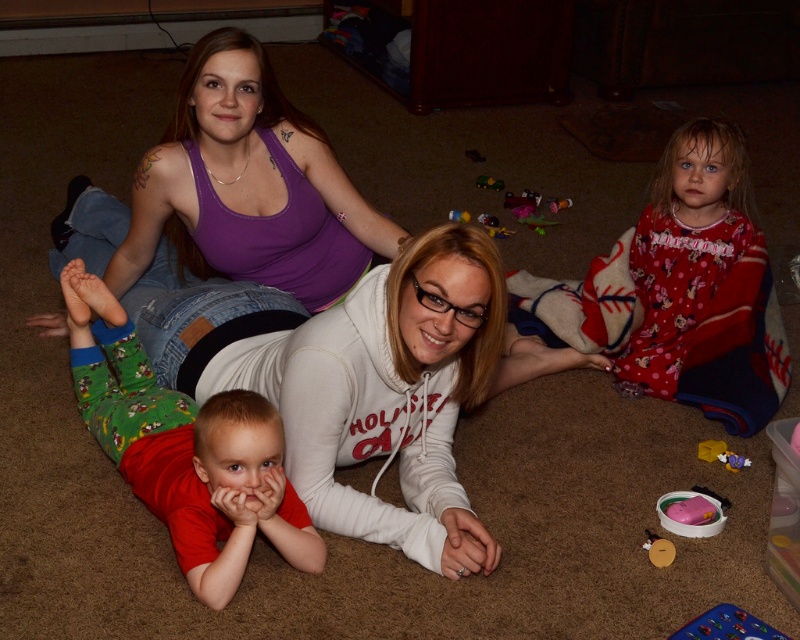
What is the location of the point at coordinates (186, 449) in relation to the green cotton pants at lower left?

The point at coordinates (186, 449) is located on the green cotton pants at lower left.

You are standing in the living room and want to take a photo of the point at coordinate [142,422]. Is the point within your camera frame? The camera has a 1.5 meter focal length.

The point at coordinate [142,422] is 2.04 meters away from the camera, which is beyond the camera frame since the focal length is 1.5 meters. The point will not be in focus.

Consider the image. You are standing at the entrance of the living room and see the green cotton pants at lower left. Can you estimate their position using the coordinate system provided in the description?

The green cotton pants at lower left are located at coordinate point [186,449] according to the description.